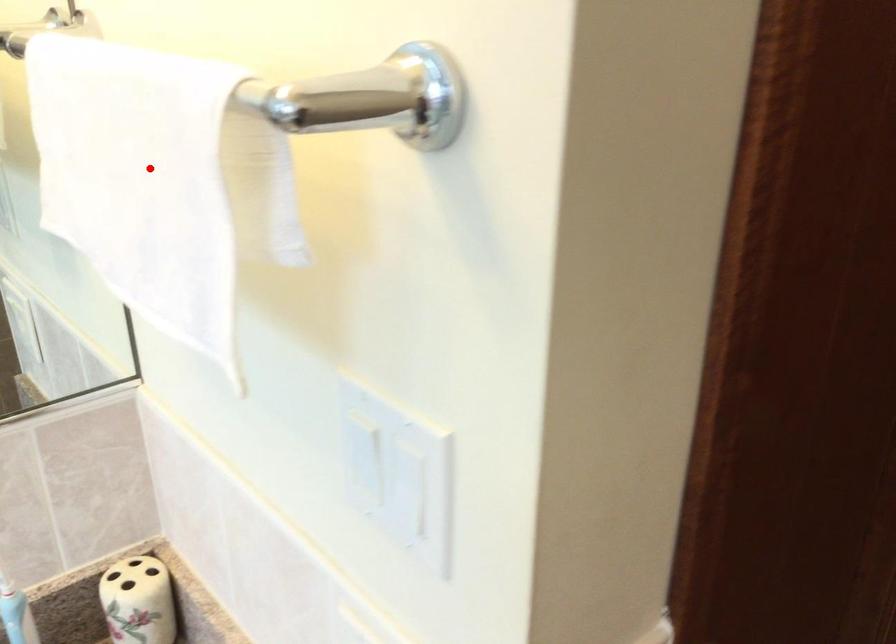
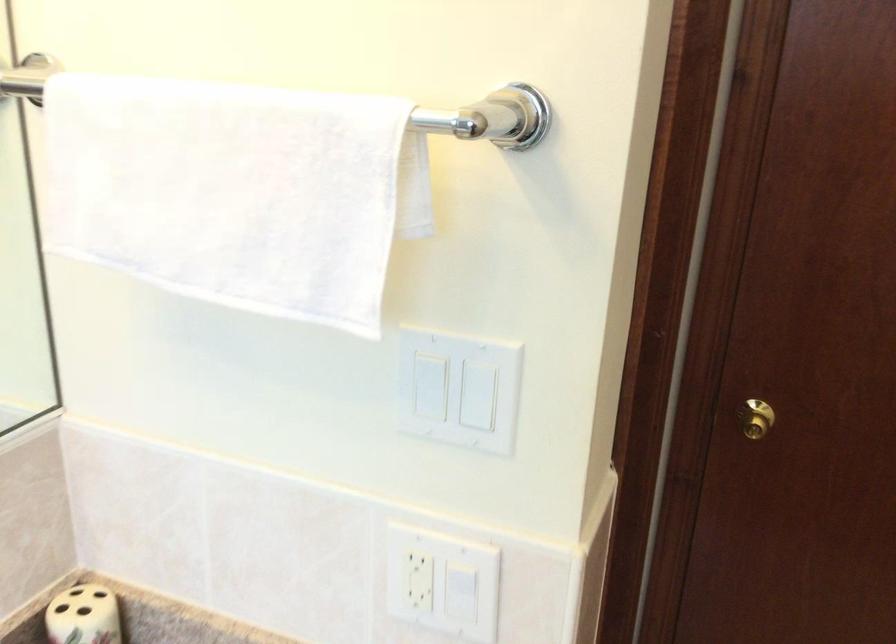
Question: I am providing you with two images of the same scene from different viewpoints. In image1, a red point is highlighted. Considering the same 3D point in image2, which of the following is correct?

Choices:
 (A) It is closer
 (B) It is farther

Answer: (B)